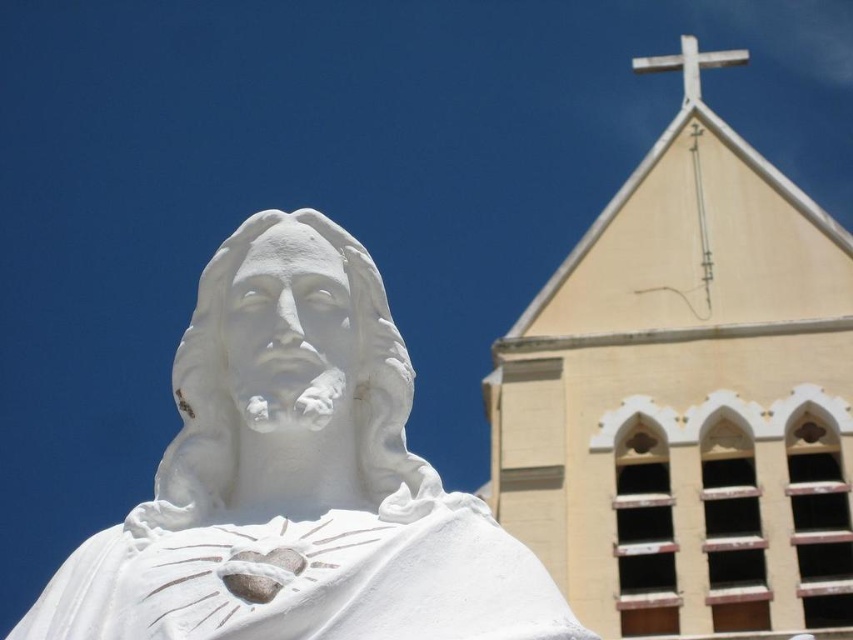
Question: Considering the real-world distances, which object is farthest from the beige stone church at upper right?

Choices:
 (A) white marble statue at center
 (B) white wooden cross at upper center

Answer: (A)

Question: From the image, what is the correct spatial relationship of beige stone church at upper right in relation to white marble statue at center?

Choices:
 (A) above
 (B) below

Answer: (A)

Question: Is white marble statue at center wider than white wooden cross at upper center?

Choices:
 (A) no
 (B) yes

Answer: (A)

Question: Can you confirm if beige stone church at upper right is positioned to the left of white wooden cross at upper center?

Choices:
 (A) no
 (B) yes

Answer: (B)

Question: Among these objects, which one is farthest from the camera?

Choices:
 (A) white marble statue at center
 (B) beige stone church at upper right
 (C) white wooden cross at upper center

Answer: (C)

Question: Which point is closer to the camera taking this photo?

Choices:
 (A) (643, 557)
 (B) (264, 332)

Answer: (B)